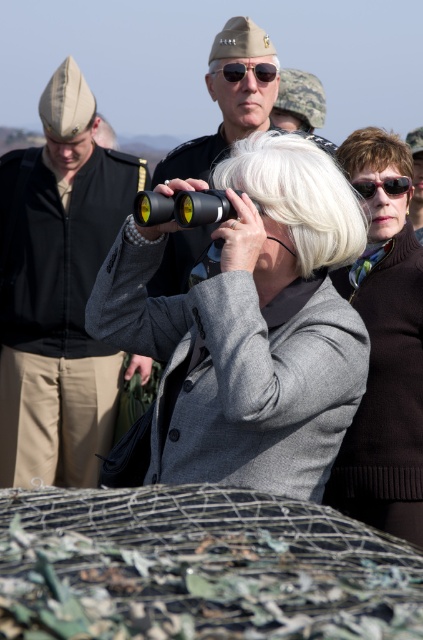
You are standing in the scene and want to locate the brushed metal hat at left. According to the coordinates provided, where should you look relative to the other objects in the scene?

The brushed metal hat at left is located at point coordinates, so you should look to the left side of the scene where the coordinates indicate its position.

From the picture: You are a photographer trying to capture a photo of the brushed metal hat at left and the camera in the scene. Given that the camera has a maximum zoom range of 6 meters, will you be able to frame both objects in the same photo without moving closer?

The distance between the brushed metal hat at left and the camera is 6.96 meters, which exceeds the camera maximum zoom range of 6 meters. Therefore, you cannot frame both objects in the same photo without moving closer.